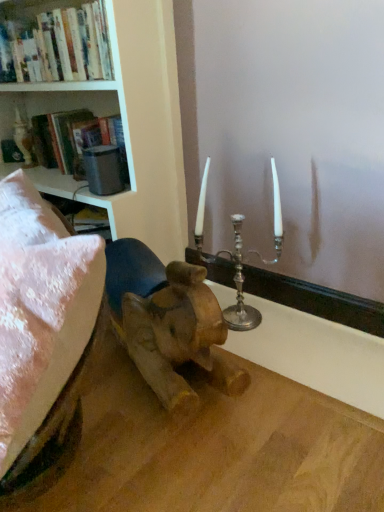
Question: Is the depth of matte black bookshelf at upper left less than that of hardcover books at upper left?

Choices:
 (A) yes
 (B) no

Answer: (B)

Question: Considering the relative sizes of matte black bookshelf at upper left and hardcover books at upper left in the image provided, is matte black bookshelf at upper left shorter than hardcover books at upper left?

Choices:
 (A) yes
 (B) no

Answer: (A)

Question: Does matte black bookshelf at upper left have a larger size compared to hardcover books at upper left?

Choices:
 (A) no
 (B) yes

Answer: (A)

Question: Is hardcover books at upper left surrounded by matte black bookshelf at upper left?

Choices:
 (A) yes
 (B) no

Answer: (B)

Question: Is matte black bookshelf at upper left beside hardcover books at upper left?

Choices:
 (A) no
 (B) yes

Answer: (A)

Question: From a real-world perspective, is matte black bookshelf at upper left positioned above or below silver metallic candlestick at upper center?

Choices:
 (A) above
 (B) below

Answer: (A)

Question: From their relative heights in the image, would you say matte black bookshelf at upper left is taller or shorter than silver metallic candlestick at upper center?

Choices:
 (A) short
 (B) tall

Answer: (B)

Question: Considering the relative positions of matte black bookshelf at upper left and silver metallic candlestick at upper center in the image provided, is matte black bookshelf at upper left to the left or to the right of silver metallic candlestick at upper center?

Choices:
 (A) left
 (B) right

Answer: (A)

Question: Does point (1, 128) appear closer or farther from the camera than point (365, 324)?

Choices:
 (A) farther
 (B) closer

Answer: (A)

Question: Visually, is hardcover books at upper left positioned to the left or to the right of silver metallic candlestick at upper center?

Choices:
 (A) right
 (B) left

Answer: (B)

Question: In terms of size, does hardcover books at upper left appear bigger or smaller than silver metallic candlestick at upper center?

Choices:
 (A) big
 (B) small

Answer: (A)

Question: Would you say hardcover books at upper left is inside or outside silver metallic candlestick at upper center?

Choices:
 (A) outside
 (B) inside

Answer: (A)

Question: From the image's perspective, relative to silver metallic candlestick at upper center, is hardcover books at upper left above or below?

Choices:
 (A) below
 (B) above

Answer: (B)

Question: Choose the correct answer: Is matte black bookshelf at upper left inside hardcover books at upper left or outside it?

Choices:
 (A) outside
 (B) inside

Answer: (A)

Question: Based on their positions, is matte black bookshelf at upper left located to the left or right of hardcover books at upper left?

Choices:
 (A) left
 (B) right

Answer: (B)